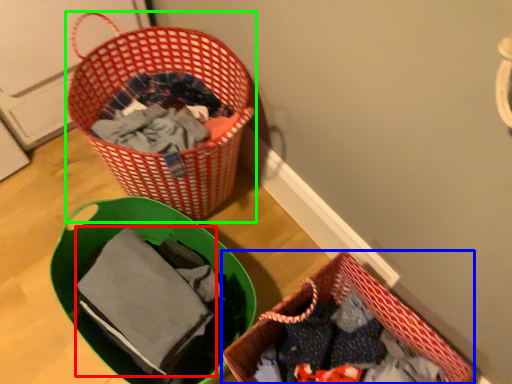
Question: Which object is the farthest from baby clothe (highlighted by a red box)? Choose among these: picnic basket (highlighted by a blue box) or picnic basket (highlighted by a green box).

Choices:
 (A) picnic basket
 (B) picnic basket

Answer: (B)